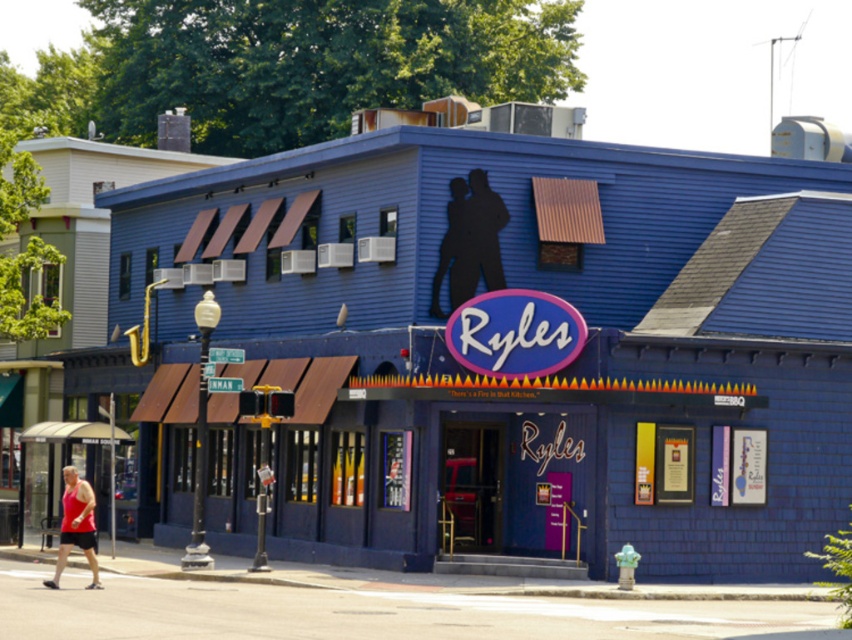
You are a delivery person standing at the entrance of Ryles, the jazz club. You need to deliver a package to the blue wooden shed at lower left and then to the red tank top at lower left. Can you complete both deliveries without needing to return to the entrance?

The distance between the blue wooden shed at lower left and the red tank top at lower left is 7.65 meters. Since the two locations are separated by this distance, you can complete both deliveries without needing to return to the entrance as the path is direct.

You are standing in front of the Ryles storefront. Where exactly is the blue wooden shed at lower left located in terms of coordinates?

The blue wooden shed at lower left is located at point (517, 346).

You are standing in front of the entrance to Ryles jazz club. There are two points marked on the entrance wall. One is at coordinate point (836, 422) and the other is at point (76, 493). Which point is closer to you?

Point (836, 422) is further to the viewer than point (76, 493), so the point at (76, 493) is closer to you.